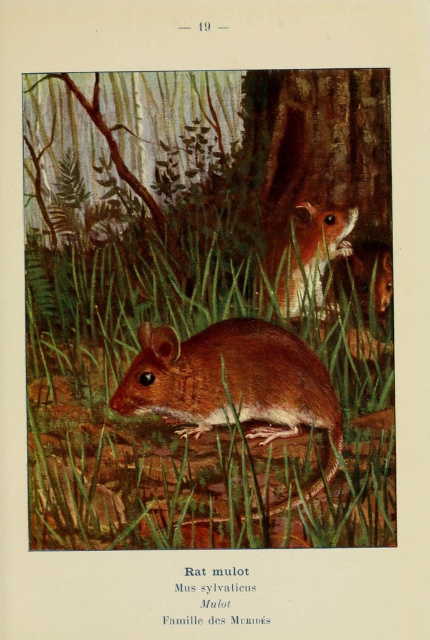
You are a small insect trying to cross from the green grass at center to the brown furry mouse at upper right. Which path would require moving through a narrower space?

The path to the brown furry mouse at upper right requires moving through a narrower space because the green grass at center is wider than the brown furry mouse at upper right.

You are a small insect trying to hide from predators in this forest scene. You see the green grass at center and the brown furry mouse at center. Which object is taller, allowing you to hide behind it?

The green grass at center is taller than the brown furry mouse at center, so you can hide behind the green grass at center.